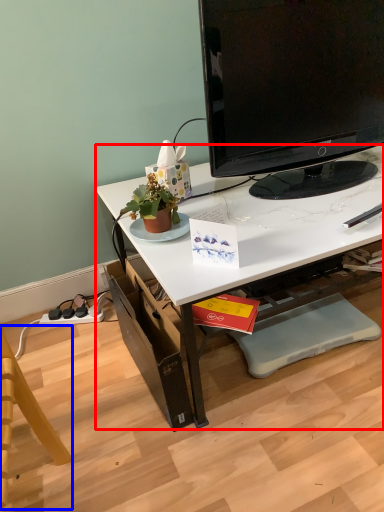
Question: Among these objects, which one is nearest to the camera, desk (highlighted by a red box) or swivel chair (highlighted by a blue box)?

Choices:
 (A) desk
 (B) swivel chair

Answer: (B)